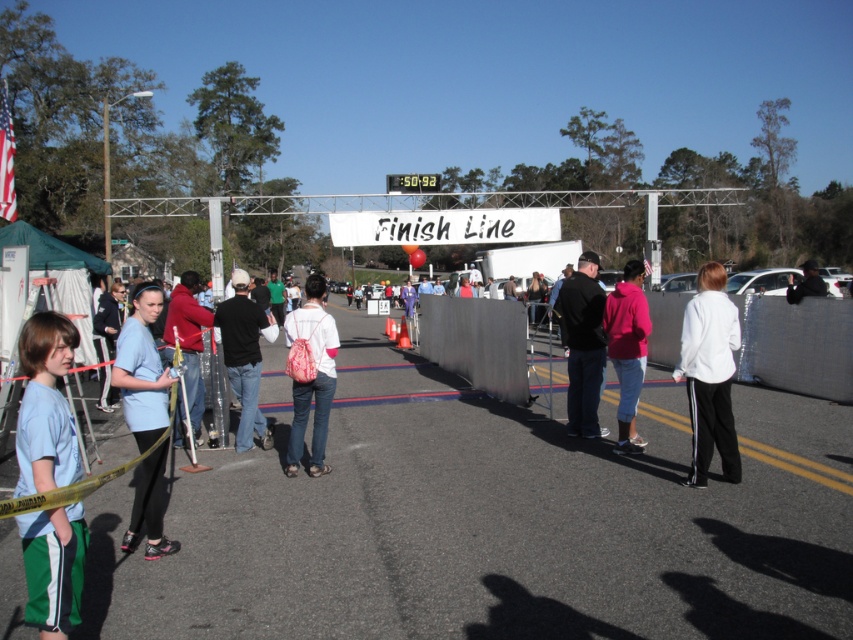
You are a spectator at the finish line and want to take a photo of the pink fleece jacket at center without the metallic gray barrier at center blocking the view. Is the barrier in the way of the jacket?

The metallic gray barrier at center is above the pink fleece jacket at center, so the barrier is blocking the view of the jacket from below. To take a photo without the barrier, you would need to position yourself higher or move the jacket, but since you can only move yourself, you should try moving higher to get a clear shot.

You are a photographer positioned at the finish line of a running event. You want to capture a photo that includes both the dark blue jeans at center and the pink fleece jacket at center. What is the minimum distance you should set your camera lens to ensure both subjects are in frame?

The dark blue jeans at center and pink fleece jacket at center are 4.73 meters apart. To include both in the frame, the camera lens should be set to a focal length that can accommodate a subject distance of at least 4.73 meters apart.